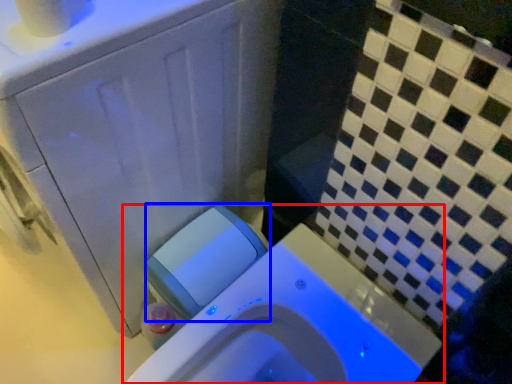
Question: Which of the following is the farthest to the observer, toilet (highlighted by a red box) or water tank (highlighted by a blue box)?

Choices:
 (A) toilet
 (B) water tank

Answer: (B)